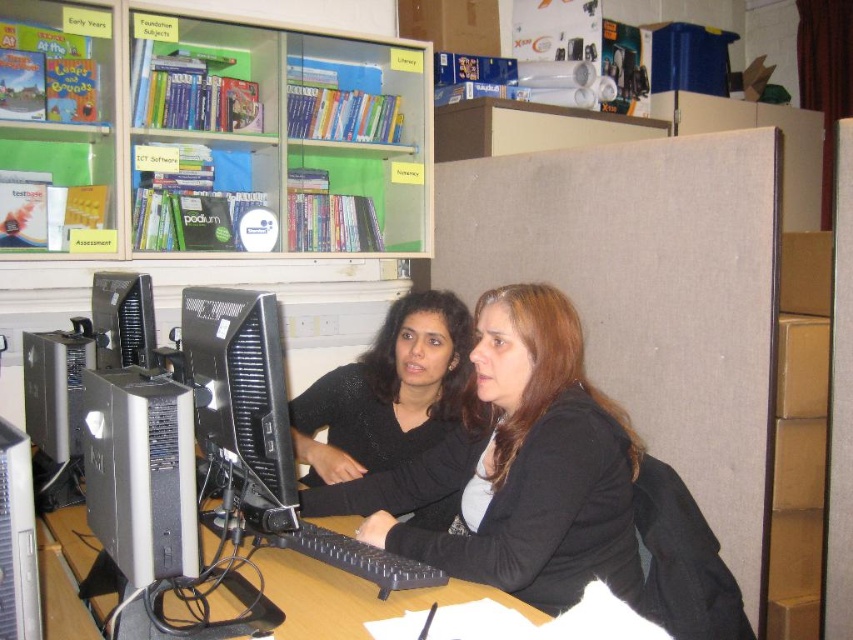
Is point (531, 420) farther from viewer compared to point (143, 406)?

Yes, point (531, 420) is farther from viewer.

The height and width of the screenshot is (640, 853). What do you see at coordinates (515, 467) in the screenshot?
I see `matte black sweater at center` at bounding box center [515, 467].

Does point (480, 328) come behind point (135, 401)?

Yes, point (480, 328) is farther from viewer.

Identify the location of matte black sweater at center. (515, 467).

What are the coordinates of `black glossy monitor at center` in the screenshot? It's located at (242, 396).

Between black glossy monitor at center and matte black monitor at left, which one appears on the left side from the viewer's perspective?

matte black monitor at left

Is point (273, 337) more distant than point (97, 285)?

No, (273, 337) is closer to viewer.

The width and height of the screenshot is (853, 640). Find the location of `black glossy monitor at center`. black glossy monitor at center is located at coordinates (242, 396).

At what (x,y) coordinates should I click in order to perform the action: click on clear plastic bookshelf at upper left. Please return your answer as a coordinate pair (x, y). This screenshot has height=640, width=853. Looking at the image, I should click on (236, 124).

Does clear plastic bookshelf at upper left have a greater height compared to matte black sweater at center?

Yes.

Measure the distance between point (x=215, y=140) and camera.

Point (x=215, y=140) is 2.68 meters from camera.

Where is `clear plastic bookshelf at upper left`? clear plastic bookshelf at upper left is located at coordinates (236, 124).